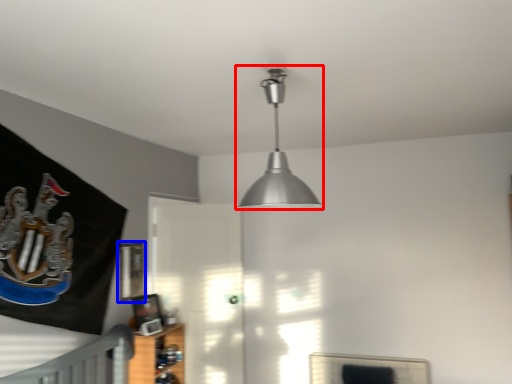
Question: Among these objects, which one is farthest to the camera, lamp (highlighted by a red box) or picture frame (highlighted by a blue box)?

Choices:
 (A) lamp
 (B) picture frame

Answer: (B)